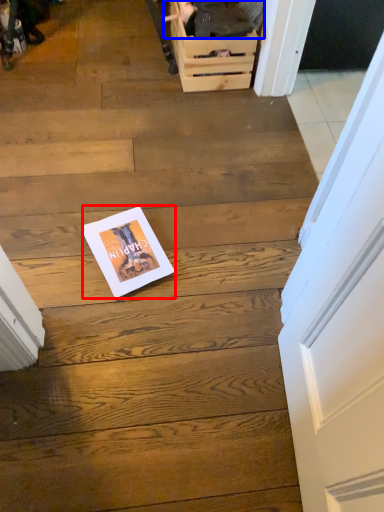
Question: Which of the following is the farthest to the observer, magazine (highlighted by a red box) or couple (highlighted by a blue box)?

Choices:
 (A) magazine
 (B) couple

Answer: (B)